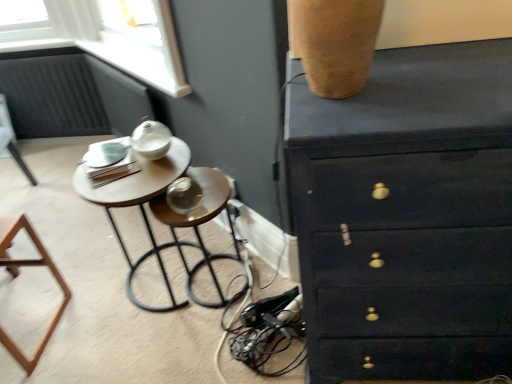
Question: Is matte white lamp at upper left, the 2th furniture from the bottom, at the right side of wooden bar stool at center?

Choices:
 (A) yes
 (B) no

Answer: (B)

Question: Considering the relative sizes of matte white lamp at upper left, positioned as the first furniture in top-to-bottom order, and wooden bar stool at center in the image provided, is matte white lamp at upper left, positioned as the first furniture in top-to-bottom order, bigger than wooden bar stool at center?

Choices:
 (A) yes
 (B) no

Answer: (B)

Question: From a real-world perspective, is matte white lamp at upper left, acting as the 2th furniture starting from the front, over wooden bar stool at center?

Choices:
 (A) yes
 (B) no

Answer: (B)

Question: Is matte white lamp at upper left, positioned as the second furniture in right-to-left order, further to camera compared to wooden bar stool at center?

Choices:
 (A) yes
 (B) no

Answer: (A)

Question: Is matte white lamp at upper left, positioned as the first furniture in top-to-bottom order, to the left of wooden bar stool at center from the viewer's perspective?

Choices:
 (A) no
 (B) yes

Answer: (B)

Question: Would you say matte white lamp at upper left, positioned as the first furniture in top-to-bottom order, is inside or outside wooden bar stool at center?

Choices:
 (A) inside
 (B) outside

Answer: (B)

Question: Considering the positions of point (15, 155) and point (200, 178), is point (15, 155) closer or farther from the camera than point (200, 178)?

Choices:
 (A) closer
 (B) farther

Answer: (B)

Question: From the image's perspective, relative to wooden bar stool at center, is matte white lamp at upper left, positioned as the second furniture in right-to-left order, above or below?

Choices:
 (A) above
 (B) below

Answer: (A)

Question: Is matte white lamp at upper left, the 1th furniture viewed from the left, in front of or behind wooden bar stool at center in the image?

Choices:
 (A) front
 (B) behind

Answer: (B)

Question: Would you say wooden bar stool at center is to the left or to the right of dark wood chest of drawers at upper right in the picture?

Choices:
 (A) left
 (B) right

Answer: (A)

Question: In terms of size, does wooden bar stool at center appear bigger or smaller than dark wood chest of drawers at upper right?

Choices:
 (A) big
 (B) small

Answer: (B)

Question: From the image's perspective, is wooden bar stool at center located above or below dark wood chest of drawers at upper right?

Choices:
 (A) below
 (B) above

Answer: (A)

Question: Is wooden bar stool at center inside the boundaries of dark wood chest of drawers at upper right, or outside?

Choices:
 (A) inside
 (B) outside

Answer: (B)

Question: In terms of size, does wooden bar stool at center appear bigger or smaller than matte white lamp at upper left, arranged as the first furniture when viewed from the back?

Choices:
 (A) big
 (B) small

Answer: (A)

Question: Is wooden bar stool at center in front of or behind matte white lamp at upper left, the 1th furniture viewed from the left, in the image?

Choices:
 (A) behind
 (B) front

Answer: (B)